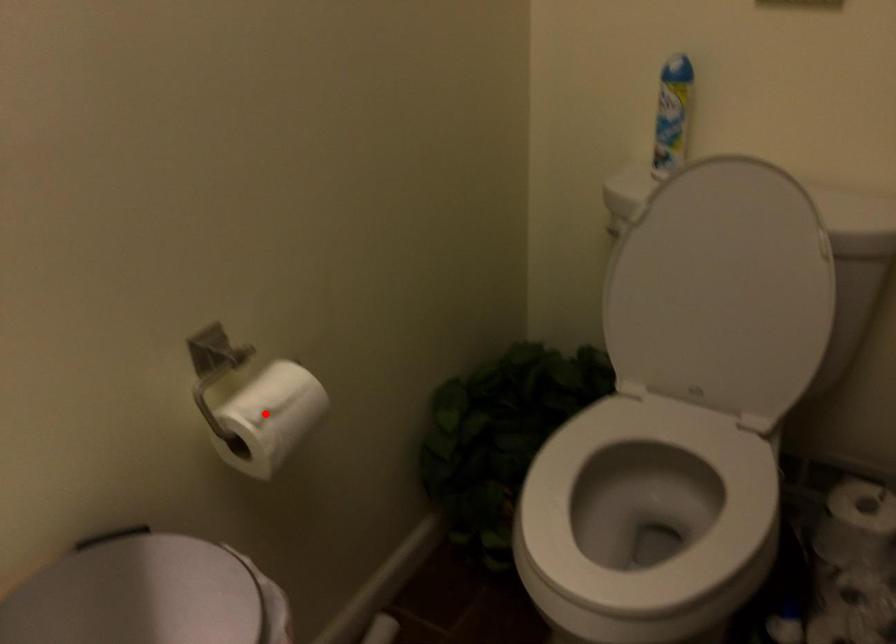
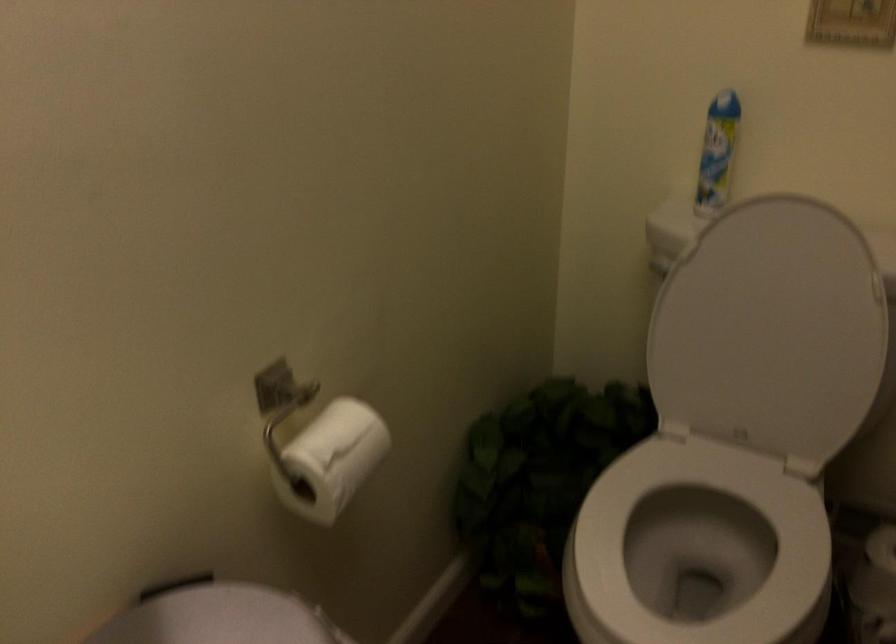
Question: I am providing you with two images of the same scene from different viewpoints. A red point is marked on the first image. At the location where the point appears in image 1, is it still visible in image 2?

Choices:
 (A) Yes
 (B) No

Answer: (A)